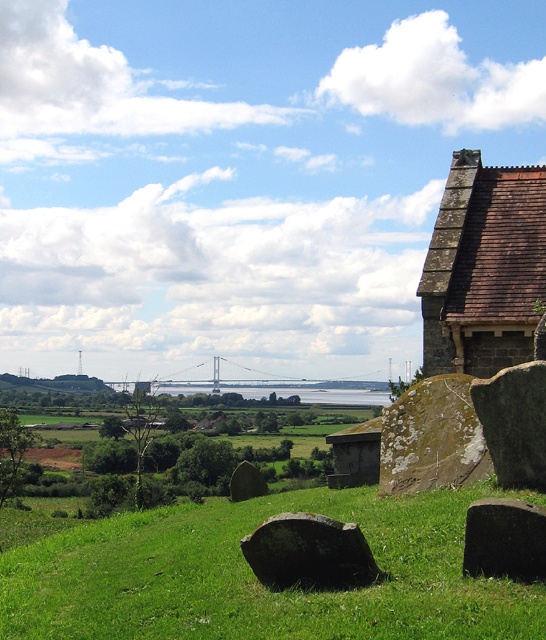
You are standing at the point closest to the stone building with the dark brown tiled roof. Which of the two points, point [414,474] or point [470,557], is farther away from you?

Point [414,474] is farther away from you because it is behind point [470,557].